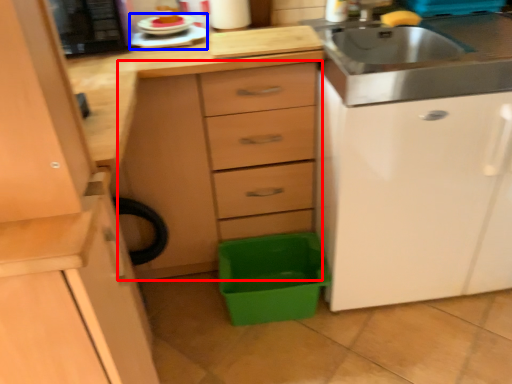
Question: Which of the following is the closest to the observer, chest of drawers (highlighted by a red box) or appliance (highlighted by a blue box)?

Choices:
 (A) chest of drawers
 (B) appliance

Answer: (A)